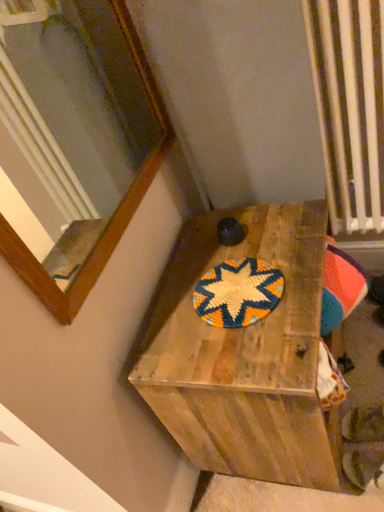
Find the location of a particular element. The height and width of the screenshot is (512, 384). brightly woven mat at center is located at coordinates (238, 293).

The width and height of the screenshot is (384, 512). What do you see at coordinates (245, 355) in the screenshot? I see `wooden box at center` at bounding box center [245, 355].

Measure the distance between point (x=121, y=125) and camera.

The distance of point (x=121, y=125) from camera is 1.19 meters.

This screenshot has width=384, height=512. Identify the location of wooden frame at upper left. (75, 102).

This screenshot has height=512, width=384. What are the coordinates of `brightly woven mat at center` in the screenshot? It's located at (238, 293).

Which is more to the right, brightly woven mat at center or wooden box at center?

Positioned to the right is wooden box at center.

What's the angular difference between brightly woven mat at center and wooden box at center's facing directions?

The facing directions of brightly woven mat at center and wooden box at center are 0.000598 degrees apart.

From the image's perspective, is brightly woven mat at center over wooden box at center?

Yes, from the image's perspective, brightly woven mat at center is over wooden box at center.

Is brightly woven mat at center inside the boundaries of wooden box at center, or outside?

brightly woven mat at center can be found inside wooden box at center.

From a real-world perspective, is wooden box at center beneath wooden frame at upper left?

Indeed, from a real-world perspective, wooden box at center is positioned beneath wooden frame at upper left.

Considering the sizes of objects wooden box at center and wooden frame at upper left in the image provided, who is bigger, wooden box at center or wooden frame at upper left?

With larger size is wooden box at center.

Which object is more forward, wooden box at center or wooden frame at upper left?

wooden frame at upper left.

Locate an element on the screen. This screenshot has height=512, width=384. mirror in front of the wooden box at center is located at coordinates (75, 102).

Is wooden frame at upper left facing towards brightly woven mat at center?

No, wooden frame at upper left is not turned towards brightly woven mat at center.

From the picture: From a real-world perspective, which is physically above, wooden frame at upper left or brightly woven mat at center?

wooden frame at upper left.

Between wooden frame at upper left and brightly woven mat at center, which one appears on the right side from the viewer's perspective?

Positioned to the right is brightly woven mat at center.

Can you see wooden frame at upper left touching brightly woven mat at center?

wooden frame at upper left is not next to brightly woven mat at center, and they're not touching.

Which is farther from the camera, (133, 170) or (301, 354)?

The point (133, 170) is farther.

In the scene shown: Does wooden frame at upper left come behind wooden box at center?

No, wooden frame at upper left is in front of wooden box at center.

From the picture: Is the surface of wooden frame at upper left in direct contact with wooden box at center?

No, wooden frame at upper left is not making contact with wooden box at center.

How much distance is there between wooden box at center and brightly woven mat at center?

16.66 centimeters.

Can you confirm if wooden box at center is positioned to the left of brightly woven mat at center?

In fact, wooden box at center is to the right of brightly woven mat at center.

Is point (274, 215) closer or farther from the camera than point (239, 275)?

Point (274, 215).

Is brightly woven mat at center facing towards wooden frame at upper left?

No, brightly woven mat at center is not turned towards wooden frame at upper left.

Is brightly woven mat at center shorter than wooden frame at upper left?

Correct, brightly woven mat at center is not as tall as wooden frame at upper left.

At what (x,y) coordinates should I click in order to perform the action: click on furniture below the brightly woven mat at center (from the image's perspective). Please return your answer as a coordinate pair (x, y). Image resolution: width=384 pixels, height=512 pixels. Looking at the image, I should click on (245, 355).

Locate an element on the screen. This screenshot has height=512, width=384. mirror that is above the wooden box at center (from the image's perspective) is located at coordinates 75,102.

Based on their spatial positions, is brightly woven mat at center or wooden frame at upper left further from wooden box at center?

wooden frame at upper left lies further to wooden box at center than the other object.

Looking at the image, which one is located closer to wooden box at center, wooden frame at upper left or brightly woven mat at center?

brightly woven mat at center is closer to wooden box at center.

Looking at the image, which one is located closer to brightly woven mat at center, wooden box at center or wooden frame at upper left?

wooden box at center is closer to brightly woven mat at center.

When comparing their distances from brightly woven mat at center, does wooden frame at upper left or wooden box at center seem closer?

wooden box at center lies closer to brightly woven mat at center than the other object.

Looking at the image, which one is located closer to wooden frame at upper left, wooden box at center or brightly woven mat at center?

wooden box at center is closer to wooden frame at upper left.

When comparing their distances from wooden frame at upper left, does brightly woven mat at center or wooden box at center seem further?

Based on the image, brightly woven mat at center appears to be further to wooden frame at upper left.

What are the coordinates of `mat between wooden frame at upper left and wooden box at center in the vertical direction` in the screenshot? It's located at (238, 293).